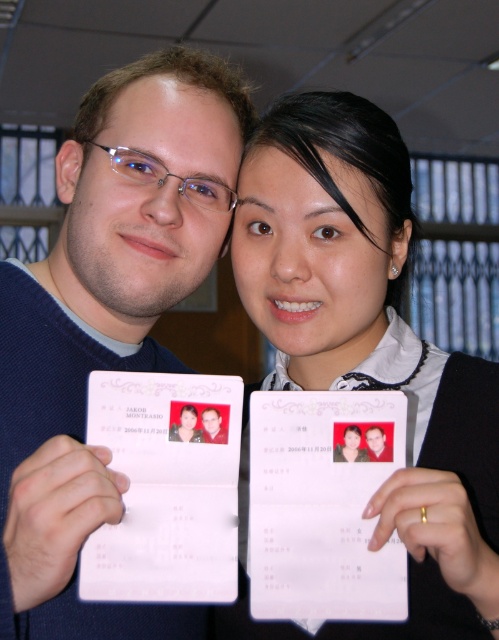
Question: Is white paper at center thinner than pink paper calendar at center?

Choices:
 (A) no
 (B) yes

Answer: (A)

Question: Is white paper calendar at center positioned behind matte white id card at center?

Choices:
 (A) no
 (B) yes

Answer: (A)

Question: Among these objects, which one is nearest to the camera?

Choices:
 (A) matte pink passport at center
 (B) matte blue sweater at center
 (C) matte white id card at center

Answer: (B)

Question: Which object appears closest to the camera in this image?

Choices:
 (A) matte blue sweater at center
 (B) matte white id card at center
 (C) pink paper calendar at center

Answer: (A)

Question: Which point is farther from the camera taking this photo?

Choices:
 (A) click(279, 426)
 (B) click(221, 163)

Answer: (B)

Question: Can you confirm if matte blue sweater at center is positioned to the left of white paper calendar at center?

Choices:
 (A) no
 (B) yes

Answer: (B)